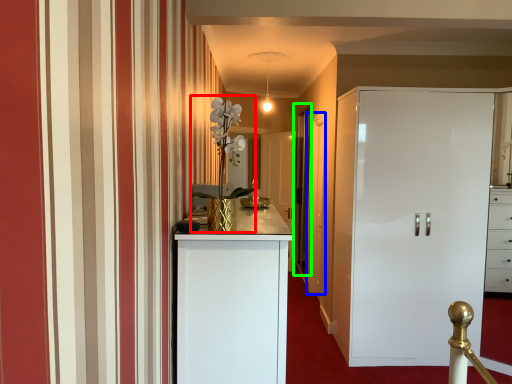
Question: Which is farther away from orchid (highlighted by a red box)? door (highlighted by a blue box) or glass door (highlighted by a green box)?

Choices:
 (A) door
 (B) glass door

Answer: (B)